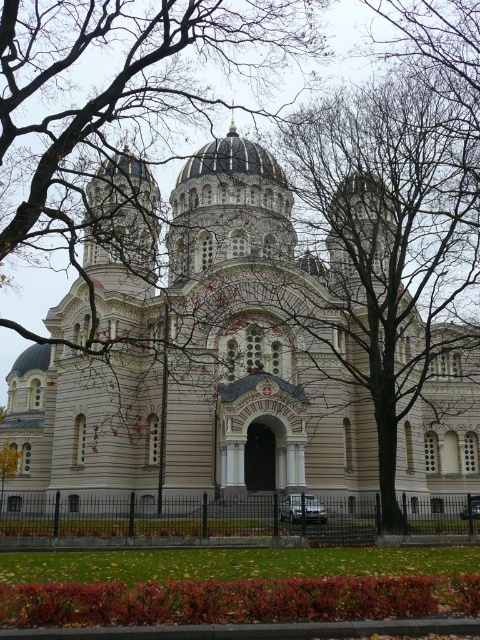
Question: In this image, where is light beige stone church at center located relative to gold domed roof at center?

Choices:
 (A) above
 (B) below

Answer: (B)

Question: Does light beige stone church at center come behind bare branches at center?

Choices:
 (A) no
 (B) yes

Answer: (B)

Question: Which object appears farthest from the camera in this image?

Choices:
 (A) light beige stone church at center
 (B) bare branches at center
 (C) gold domed roof at center

Answer: (C)

Question: Can you confirm if bare branches at center is positioned below gold domed roof at center?

Choices:
 (A) no
 (B) yes

Answer: (B)

Question: Which point is closer to the camera taking this photo?

Choices:
 (A) (191, 163)
 (B) (15, 108)

Answer: (B)

Question: Which point is closer to the camera?

Choices:
 (A) light beige stone church at center
 (B) gold domed roof at center
 (C) bare branches at center

Answer: (C)